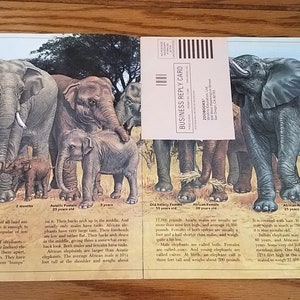
Identify the location of magazine pages. (146, 222), (135, 217).